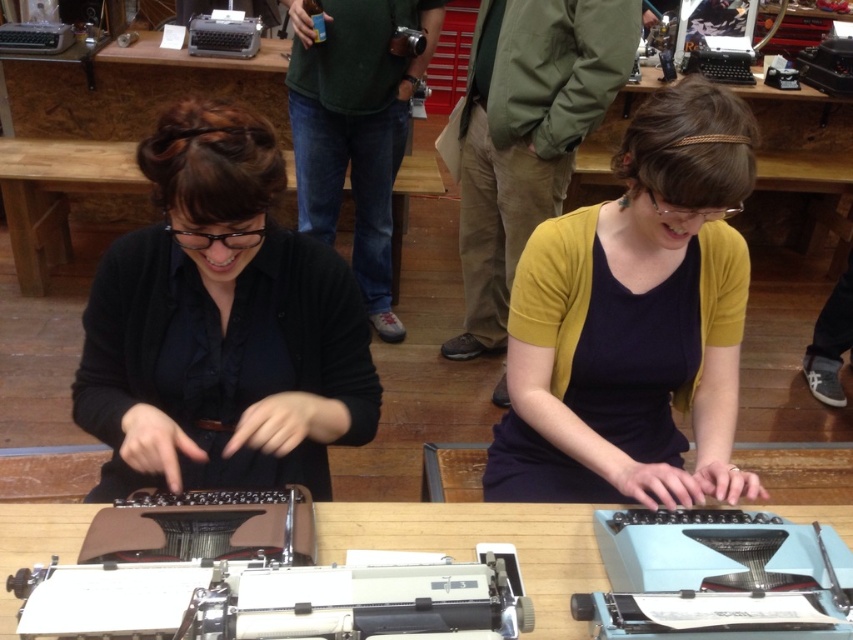
Question: Does black matte shirt at center appear on the right side of green fabric shirt at center?

Choices:
 (A) no
 (B) yes

Answer: (A)

Question: Which of the following is the closest to the observer?

Choices:
 (A) (711, 150)
 (B) (161, 346)

Answer: (A)

Question: Can you confirm if white plastic typewriter at center is thinner than wooden table at center?

Choices:
 (A) yes
 (B) no

Answer: (A)

Question: Which point is farther to the camera?

Choices:
 (A) black matte shirt at center
 (B) green fabric shirt at center
 (C) mustard yellow cardigan at center

Answer: (B)

Question: Is green fabric shirt at center thinner than wooden table at center?

Choices:
 (A) no
 (B) yes

Answer: (B)

Question: Among these points, which one is nearest to the camera?

Choices:
 (A) (54, 166)
 (B) (621, 435)
 (C) (216, 452)

Answer: (C)